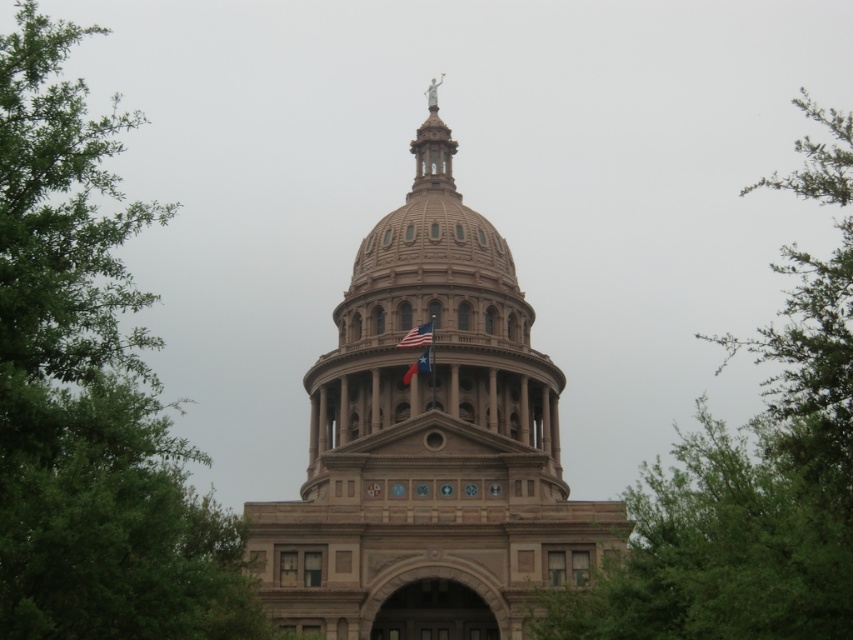
Question: Does green leafy tree at upper right have a lesser width compared to brown stone flag pole at center?

Choices:
 (A) yes
 (B) no

Answer: (B)

Question: Which of the following is the closest to the observer?

Choices:
 (A) green leafy tree at upper right
 (B) green leafy tree at lower right
 (C) brown stone dome at center
 (D) american flag at center

Answer: (B)

Question: Which object is the closest to the brown stone flag pole at center?

Choices:
 (A) green leafy tree at upper left
 (B) blue fabric flag at center
 (C) green leafy tree at upper right

Answer: (B)

Question: Is the position of american flag at center less distant than that of blue fabric flag at center?

Choices:
 (A) no
 (B) yes

Answer: (A)

Question: From the image, what is the correct spatial relationship of green leafy tree at upper right in relation to american flag at center?

Choices:
 (A) right
 (B) left

Answer: (A)

Question: Which point appears closest to the camera in this image?

Choices:
 (A) (0, 387)
 (B) (405, 346)
 (C) (773, 522)
 (D) (836, 579)

Answer: (A)